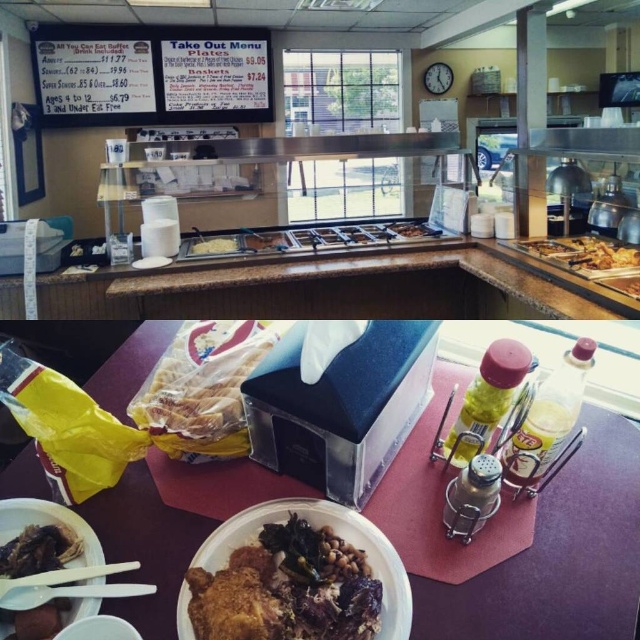
Is golden crispy chicken at center positioned behind white paper plate at center?

No.

Is golden crispy chicken at center bigger than white paper plate at center?

Yes, golden crispy chicken at center is bigger than white paper plate at center.

Describe the element at coordinates (584, 256) in the screenshot. Image resolution: width=640 pixels, height=640 pixels. I see `golden crispy chicken at center` at that location.

The height and width of the screenshot is (640, 640). I want to click on golden crispy chicken at center, so click(x=584, y=256).

Can you confirm if brown granite counter at center is thinner than white paper plate at center?

Incorrect, brown granite counter at center's width is not less than white paper plate at center's.

Who is taller, brown granite counter at center or white paper plate at center?

brown granite counter at center is taller.

Who is more distant from viewer, (170, 285) or (209, 246)?

Point (209, 246)

The height and width of the screenshot is (640, 640). Find the location of `brown granite counter at center`. brown granite counter at center is located at coordinates (333, 289).

Is point (120, 570) less distant than point (224, 240)?

Yes, it is in front of point (224, 240).

Can you confirm if white plastic chopstick at lower left is positioned to the left of white paper plate at center?

In fact, white plastic chopstick at lower left is to the right of white paper plate at center.

Who is more distant from viewer, (68, 572) or (218, 252)?

Result: Positioned behind is point (218, 252).

At what (x,y) coordinates should I click in order to perform the action: click on white plastic chopstick at lower left. Please return your answer as a coordinate pair (x, y). Looking at the image, I should click on (65, 576).